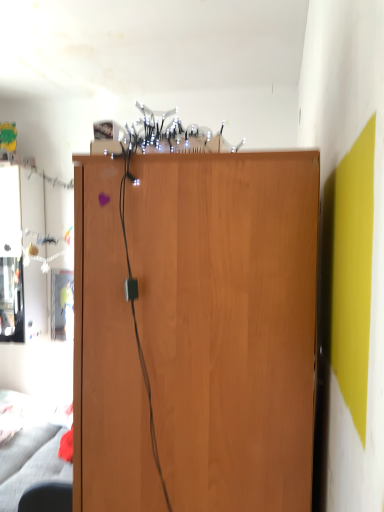
Question: From the image's perspective, is black leather swivel chair at lower left on top of wooden cupboard at center?

Choices:
 (A) yes
 (B) no

Answer: (B)

Question: Does black leather swivel chair at lower left appear on the left side of wooden cupboard at center?

Choices:
 (A) yes
 (B) no

Answer: (A)

Question: From a real-world perspective, is black leather swivel chair at lower left on wooden cupboard at center?

Choices:
 (A) no
 (B) yes

Answer: (A)

Question: Is black leather swivel chair at lower left in front of wooden cupboard at center?

Choices:
 (A) yes
 (B) no

Answer: (B)

Question: Does black leather swivel chair at lower left have a larger size compared to wooden cupboard at center?

Choices:
 (A) no
 (B) yes

Answer: (A)

Question: Is black leather swivel chair at lower left located outside wooden cupboard at center?

Choices:
 (A) yes
 (B) no

Answer: (A)

Question: Can you confirm if wooden cupboard at center is thinner than black leather swivel chair at lower left?

Choices:
 (A) no
 (B) yes

Answer: (A)

Question: Does wooden cupboard at center have a greater height compared to black leather swivel chair at lower left?

Choices:
 (A) yes
 (B) no

Answer: (A)

Question: Considering the relative positions of wooden cupboard at center and black leather swivel chair at lower left in the image provided, is wooden cupboard at center to the right of black leather swivel chair at lower left from the viewer's perspective?

Choices:
 (A) no
 (B) yes

Answer: (B)

Question: Can you see wooden cupboard at center touching black leather swivel chair at lower left?

Choices:
 (A) no
 (B) yes

Answer: (A)

Question: Is black leather swivel chair at lower left a part of wooden cupboard at center?

Choices:
 (A) yes
 (B) no

Answer: (B)

Question: Is wooden cupboard at center not near black leather swivel chair at lower left?

Choices:
 (A) no
 (B) yes

Answer: (B)

Question: Is black leather swivel chair at lower left taller or shorter than wooden cupboard at center?

Choices:
 (A) tall
 (B) short

Answer: (B)